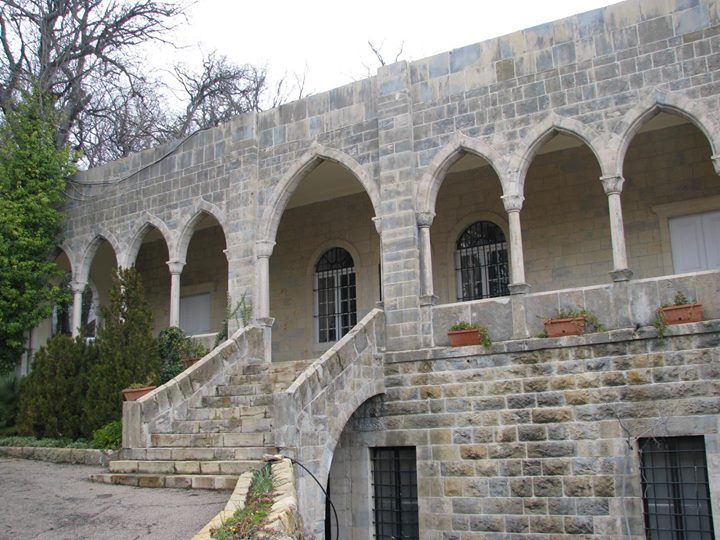
This screenshot has width=720, height=540. Find the location of `plant pots`. plant pots is located at coordinates (471, 337), (564, 320), (683, 312), (138, 390), (189, 364).